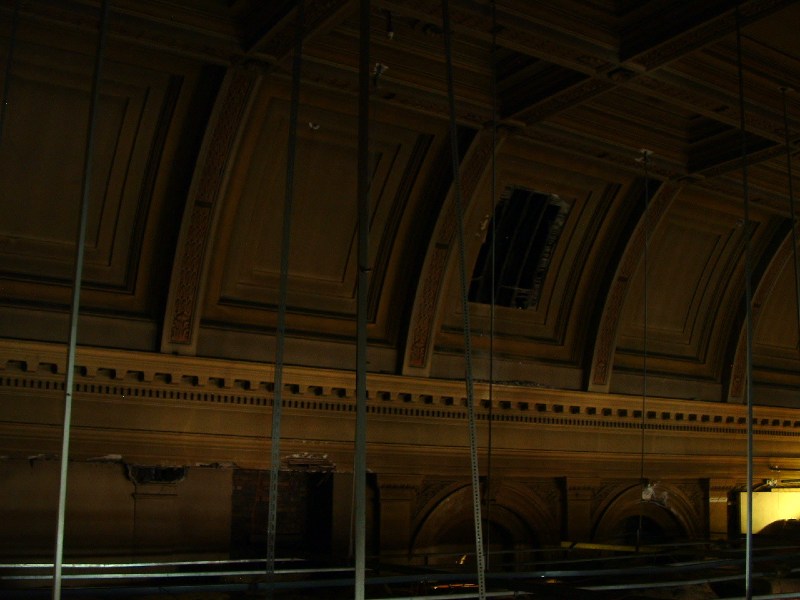
Where is `light reflecting off of the wall`? light reflecting off of the wall is located at coordinates (788, 506).